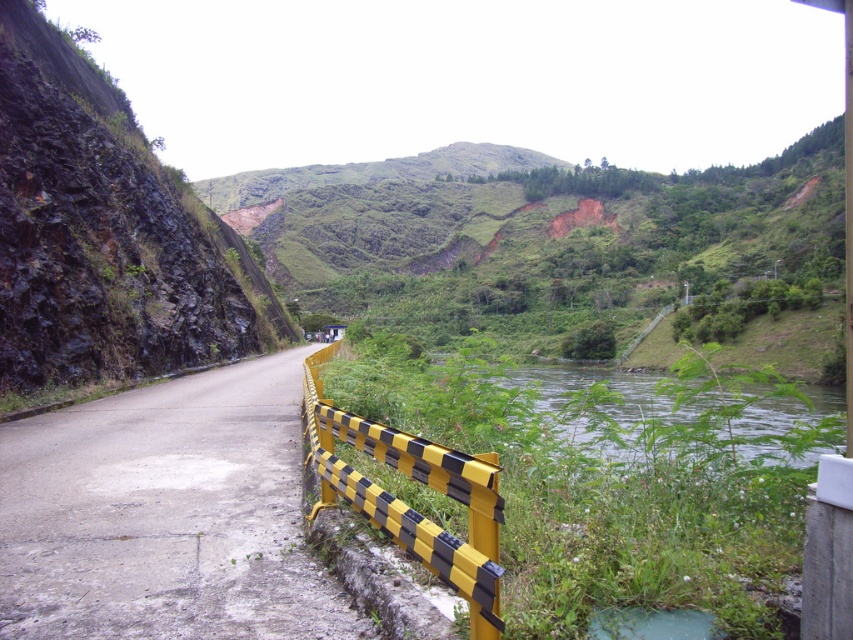
Is asphalt road at left above green leafy river at center?

Indeed, asphalt road at left is positioned over green leafy river at center.

What are the coordinates of `asphalt road at left` in the screenshot? It's located at (165, 515).

The image size is (853, 640). I want to click on asphalt road at left, so click(165, 515).

The image size is (853, 640). What do you see at coordinates (105, 232) in the screenshot?
I see `dark rock cliff at left` at bounding box center [105, 232].

Does dark rock cliff at left have a lesser width compared to yellow/black checkered barricade at lower center?

In fact, dark rock cliff at left might be wider than yellow/black checkered barricade at lower center.

Is point (120, 108) positioned before point (447, 554)?

No, it is behind (447, 554).

Where is `dark rock cliff at left`? Image resolution: width=853 pixels, height=640 pixels. dark rock cliff at left is located at coordinates (105, 232).

Does asphalt road at left have a lesser height compared to yellow/black checkered barricade at lower center?

Correct, asphalt road at left is not as tall as yellow/black checkered barricade at lower center.

Between asphalt road at left and yellow/black checkered barricade at lower center, which one has less height?

With less height is asphalt road at left.

Does point (280, 412) lie in front of point (416, 436)?

No, (280, 412) is further to viewer.

Where is `asphalt road at left`? asphalt road at left is located at coordinates (165, 515).